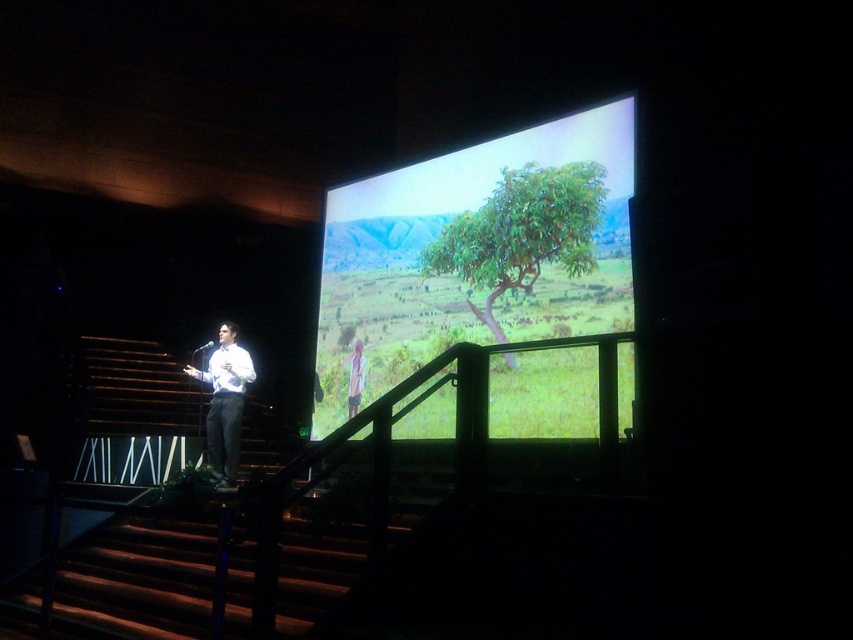
You are an event planner setting up a presentation. The screen shows a green matte tree at center. Where exactly is the green matte tree positioned on the screen?

The green matte tree at center is located at point (476, 252) on the screen.

Consider the image. You are a stagehand in the auditorium and need to place a 10 feet long extension cord from the green leafy tree at center to the white shirt at center. Will the cord be long enough to reach without moving either object?

The distance between the green leafy tree at center and the white shirt at center is 8.10 feet. Since the extension cord is 10 feet long, it will be long enough to reach without moving either object.

You are a stagehand preparing to move a 1.5 meter long ladder from the dark wood stairs at lower left to the white shirt at center. Can you fit the ladder horizontally between them without bending it?

The distance between the dark wood stairs at lower left and the white shirt at center is 1.21 meters. Since the ladder is 1.5 meters long, it cannot fit horizontally between them without bending.